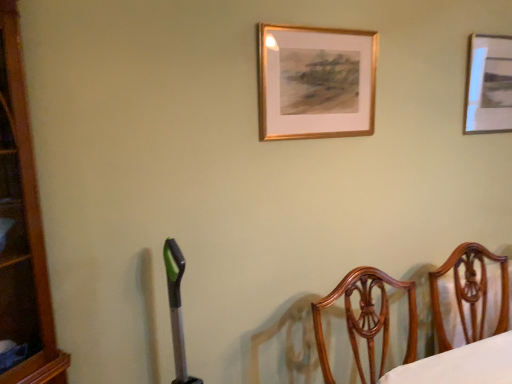
Question: Is metallic silver picture frame at upper right, which ranks as the 1th picture frame in back-to-front order, completely or partially outside of gold wooden picture frame at upper center, the 2th picture frame positioned from the right?

Choices:
 (A) no
 (B) yes

Answer: (B)

Question: Does metallic silver picture frame at upper right, which ranks as the 1th picture frame in back-to-front order, lie in front of gold wooden picture frame at upper center, acting as the first picture frame starting from the left?

Choices:
 (A) yes
 (B) no

Answer: (B)

Question: Can you confirm if metallic silver picture frame at upper right, the second picture frame viewed from the left, is shorter than gold wooden picture frame at upper center, acting as the first picture frame starting from the left?

Choices:
 (A) yes
 (B) no

Answer: (B)

Question: Can you confirm if metallic silver picture frame at upper right, which ranks as the 1th picture frame in back-to-front order, is positioned to the left of gold wooden picture frame at upper center, the 2th picture frame positioned from the right?

Choices:
 (A) yes
 (B) no

Answer: (B)

Question: Can you confirm if metallic silver picture frame at upper right, the first picture frame in the right-to-left sequence, is thinner than gold wooden picture frame at upper center, which appears as the first picture frame when viewed from the front?

Choices:
 (A) yes
 (B) no

Answer: (B)

Question: Do you think metallic silver picture frame at upper right, which ranks as the 1th picture frame in back-to-front order, is within gold wooden picture frame at upper center, the 2th picture frame positioned from the right, or outside of it?

Choices:
 (A) outside
 (B) inside

Answer: (A)

Question: Considering the positions of metallic silver picture frame at upper right, the second picture frame viewed from the left, and gold wooden picture frame at upper center, which appears as the first picture frame when viewed from the front, in the image, is metallic silver picture frame at upper right, the second picture frame viewed from the left, taller or shorter than gold wooden picture frame at upper center, which appears as the first picture frame when viewed from the front,?

Choices:
 (A) tall
 (B) short

Answer: (A)

Question: Is metallic silver picture frame at upper right, which ranks as the 1th picture frame in back-to-front order, wider or thinner than gold wooden picture frame at upper center, which appears as the first picture frame when viewed from the front?

Choices:
 (A) wide
 (B) thin

Answer: (A)

Question: Considering the positions of point (496, 49) and point (365, 61), is point (496, 49) closer or farther from the camera than point (365, 61)?

Choices:
 (A) farther
 (B) closer

Answer: (A)

Question: Is wooden chair at right in front of or behind metallic silver picture frame at upper right, the second picture frame viewed from the left, in the image?

Choices:
 (A) front
 (B) behind

Answer: (A)

Question: Would you say wooden chair at right is to the left or to the right of metallic silver picture frame at upper right, the first picture frame in the right-to-left sequence, in the picture?

Choices:
 (A) left
 (B) right

Answer: (A)

Question: Looking at their shapes, would you say wooden chair at right is wider or thinner than metallic silver picture frame at upper right, the first picture frame in the right-to-left sequence?

Choices:
 (A) thin
 (B) wide

Answer: (B)

Question: From the image's perspective, is wooden chair at right positioned above or below metallic silver picture frame at upper right, the second picture frame viewed from the left?

Choices:
 (A) above
 (B) below

Answer: (B)

Question: Is wooden chair at right wider or thinner than gold wooden picture frame at upper center, the 2th picture frame positioned from the right?

Choices:
 (A) thin
 (B) wide

Answer: (B)

Question: Is wooden chair at right bigger or smaller than gold wooden picture frame at upper center, the 2th picture frame positioned from the right?

Choices:
 (A) big
 (B) small

Answer: (A)